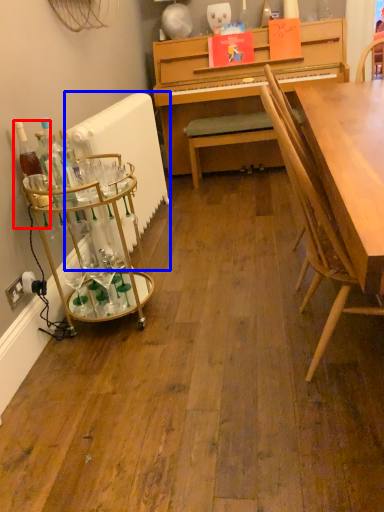
Question: Which object is further to the camera taking this photo, bottle (highlighted by a red box) or radiator (highlighted by a blue box)?

Choices:
 (A) bottle
 (B) radiator

Answer: (B)